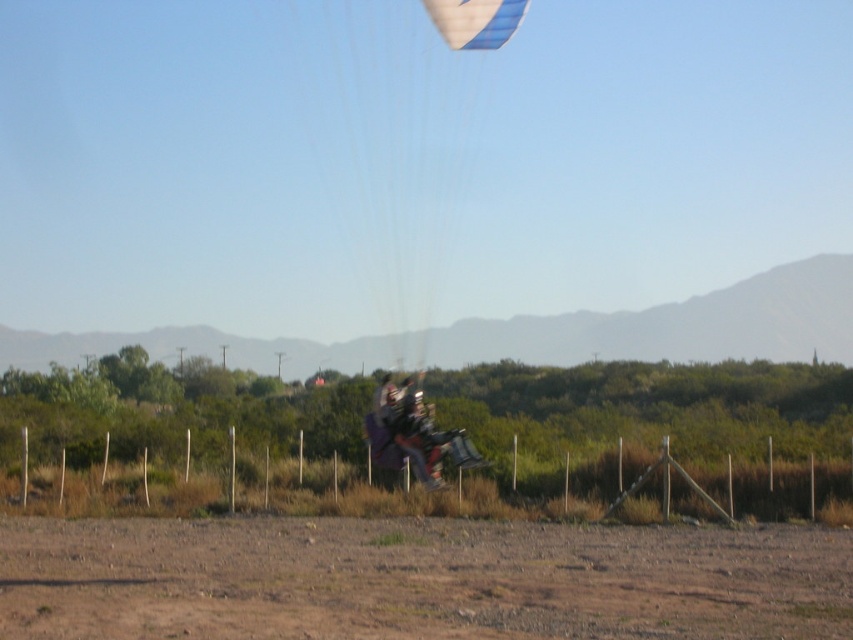
You are a photographer trying to capture a photo of the dark purple fabric parachute at center and the blue glossy parachute at upper center. From your current position, which parachute should you focus on first if you want to photograph them in order from left to right?

The dark purple fabric parachute at center should be focused on first because it is positioned to the left of the blue glossy parachute at upper center.

You are a paragliding instructor observing the scene. You notice a point marked at coordinates (405, 429). Based on the image, what object is located at that point?

The point at coordinates (405, 429) marks the location of the dark purple fabric parachute at center.

You are a hiker who wants to take a photo of the blue glossy parachute at upper center from the dull brown dirt at lower center. Will you need to look upwards or downwards to frame the shot properly?

The blue glossy parachute at upper center is taller than the dull brown dirt at lower center, so you will need to look upwards to frame the shot properly.